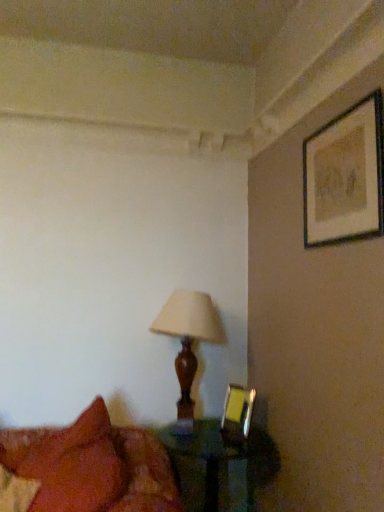
Question: Can you confirm if wooden lampshade at center is taller than matte black picture frame at upper right, the first picture frame viewed from the right?

Choices:
 (A) yes
 (B) no

Answer: (A)

Question: Does wooden lampshade at center have a smaller size compared to matte black picture frame at upper right, the 1th picture frame when ordered from top to bottom?

Choices:
 (A) yes
 (B) no

Answer: (B)

Question: Is wooden lampshade at center located outside matte black picture frame at upper right, marked as the first picture frame in a front-to-back arrangement?

Choices:
 (A) no
 (B) yes

Answer: (B)

Question: Can you confirm if wooden lampshade at center is positioned to the right of matte black picture frame at upper right, the 1th picture frame when ordered from top to bottom?

Choices:
 (A) yes
 (B) no

Answer: (B)

Question: From a real-world perspective, is wooden lampshade at center beneath matte black picture frame at upper right, marked as the first picture frame in a front-to-back arrangement?

Choices:
 (A) yes
 (B) no

Answer: (A)

Question: Is point (193, 292) closer or farther from the camera than point (162, 465)?

Choices:
 (A) closer
 (B) farther

Answer: (B)

Question: Looking at the image, does wooden lampshade at center seem bigger or smaller compared to velvet red pillow at lower left?

Choices:
 (A) small
 (B) big

Answer: (A)

Question: Is wooden lampshade at center inside the boundaries of velvet red pillow at lower left, or outside?

Choices:
 (A) inside
 (B) outside

Answer: (B)

Question: Is wooden lampshade at center in front of or behind velvet red pillow at lower left in the image?

Choices:
 (A) behind
 (B) front

Answer: (A)

Question: In terms of height, does wooden lampshade at center look taller or shorter compared to matte black picture frame at upper right, the 1th picture frame when ordered from top to bottom?

Choices:
 (A) short
 (B) tall

Answer: (B)

Question: Looking at their shapes, would you say wooden lampshade at center is wider or thinner than matte black picture frame at upper right, marked as the first picture frame in a front-to-back arrangement?

Choices:
 (A) wide
 (B) thin

Answer: (A)

Question: From a real-world perspective, relative to matte black picture frame at upper right, marked as the first picture frame in a front-to-back arrangement, is wooden lampshade at center vertically above or below?

Choices:
 (A) below
 (B) above

Answer: (A)

Question: Would you say wooden lampshade at center is to the left or to the right of matte black picture frame at upper right, which is the 2th picture frame in back-to-front order, in the picture?

Choices:
 (A) left
 (B) right

Answer: (A)

Question: Is wooden lampshade at center inside the boundaries of translucent glass table at lower center, or outside?

Choices:
 (A) inside
 (B) outside

Answer: (B)

Question: In terms of width, does wooden lampshade at center look wider or thinner when compared to translucent glass table at lower center?

Choices:
 (A) thin
 (B) wide

Answer: (A)